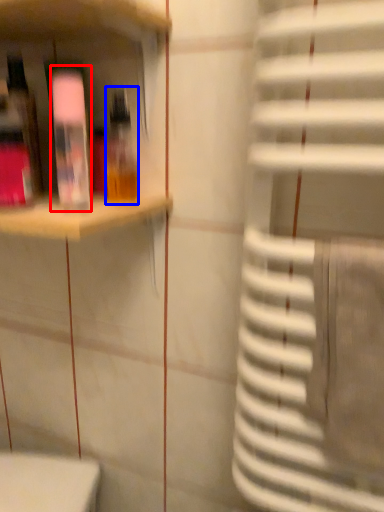
Question: Which of the following is the closest to the observer, bottle (highlighted by a red box) or bottle (highlighted by a blue box)?

Choices:
 (A) bottle
 (B) bottle

Answer: (A)